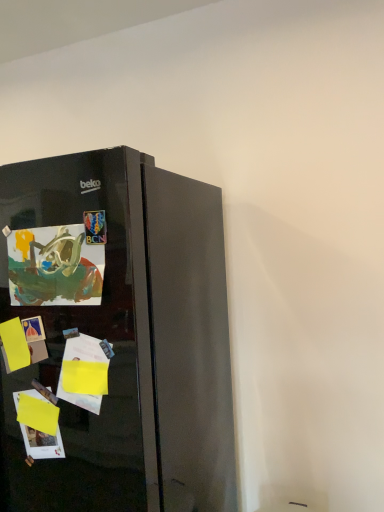
Question: Considering their positions, is glossy black refrigerator at left located in front of or behind matte paper postcard at left?

Choices:
 (A) behind
 (B) front

Answer: (B)

Question: From the image's perspective, is glossy black refrigerator at left above or below matte paper postcard at left?

Choices:
 (A) below
 (B) above

Answer: (A)

Question: Based on their positions, is glossy black refrigerator at left located to the left or right of matte paper postcard at left?

Choices:
 (A) right
 (B) left

Answer: (B)

Question: Considering the positions of matte paper postcard at left and glossy black refrigerator at left in the image, is matte paper postcard at left taller or shorter than glossy black refrigerator at left?

Choices:
 (A) tall
 (B) short

Answer: (B)

Question: Would you say matte paper postcard at left is inside or outside glossy black refrigerator at left?

Choices:
 (A) inside
 (B) outside

Answer: (A)

Question: Is point (79, 253) closer or farther from the camera than point (122, 176)?

Choices:
 (A) farther
 (B) closer

Answer: (A)

Question: Based on their sizes in the image, would you say matte paper postcard at left is bigger or smaller than glossy black refrigerator at left?

Choices:
 (A) big
 (B) small

Answer: (B)